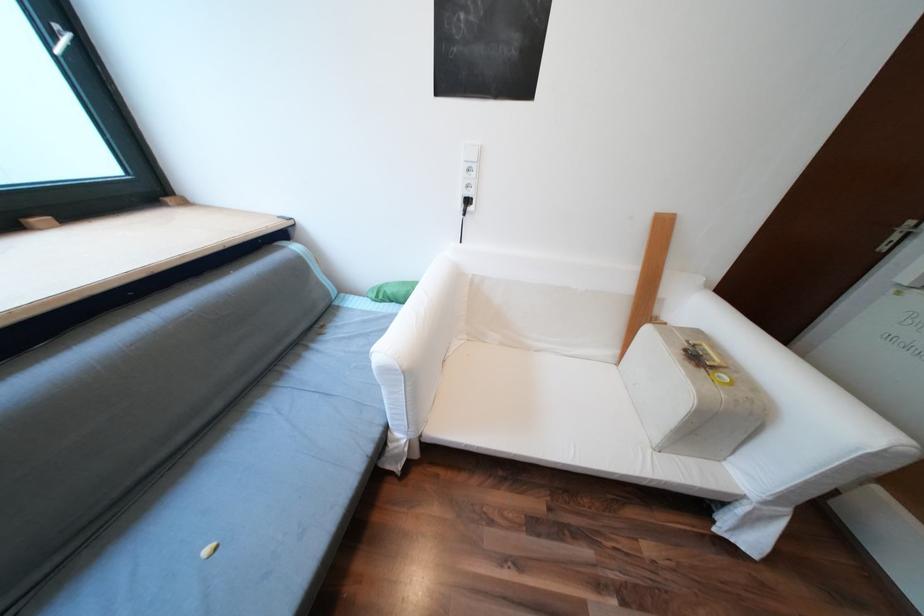
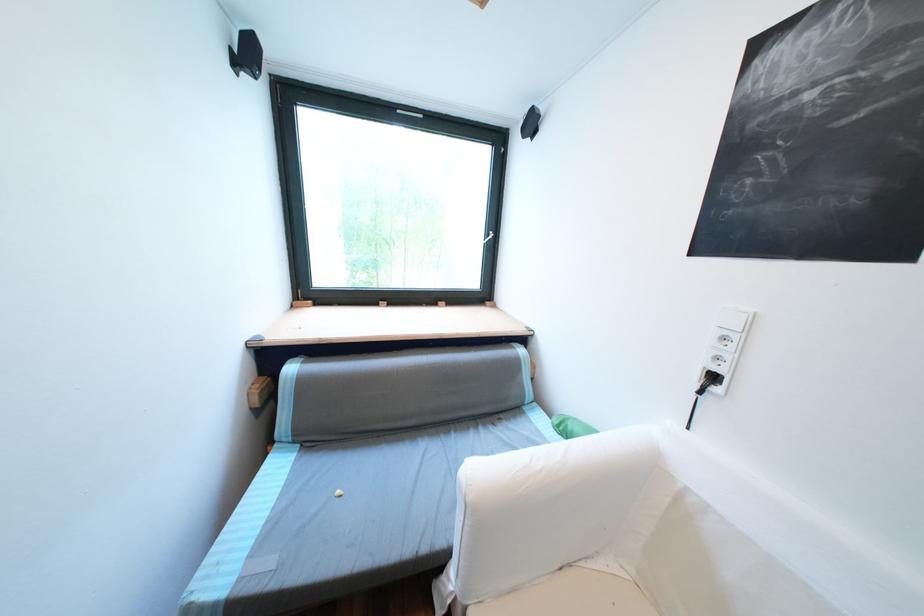
Find the pixel in the second image that matches point 477,201 in the first image.

(723, 378)